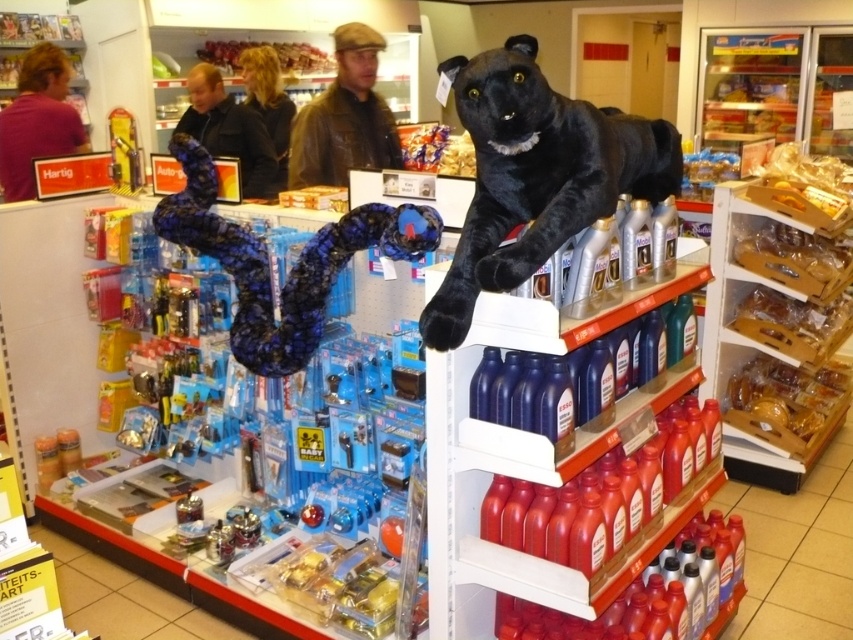
Question: Which of the following is the closest to the observer?

Choices:
 (A) (199, 177)
 (B) (19, 144)
 (C) (341, 32)
 (D) (474, 264)

Answer: (D)

Question: Which object is the farthest from the leather cap at center?

Choices:
 (A) matte pink shirt at left
 (B) black plush toy at upper center
 (C) dark brown leather jacket at upper center
 (D) blue fabric snake at center

Answer: (B)

Question: Can you confirm if blue glossy bottle at center is wider than leather cap at center?

Choices:
 (A) yes
 (B) no

Answer: (A)

Question: Which point is farther to the camera?

Choices:
 (A) (485, 147)
 (B) (410, 236)

Answer: (B)

Question: Is leather cap at center below dark brown leather jacket at upper center?

Choices:
 (A) yes
 (B) no

Answer: (B)

Question: From the image, what is the correct spatial relationship of leather cap at center in relation to dark brown leather jacket at upper center?

Choices:
 (A) left
 (B) right

Answer: (B)